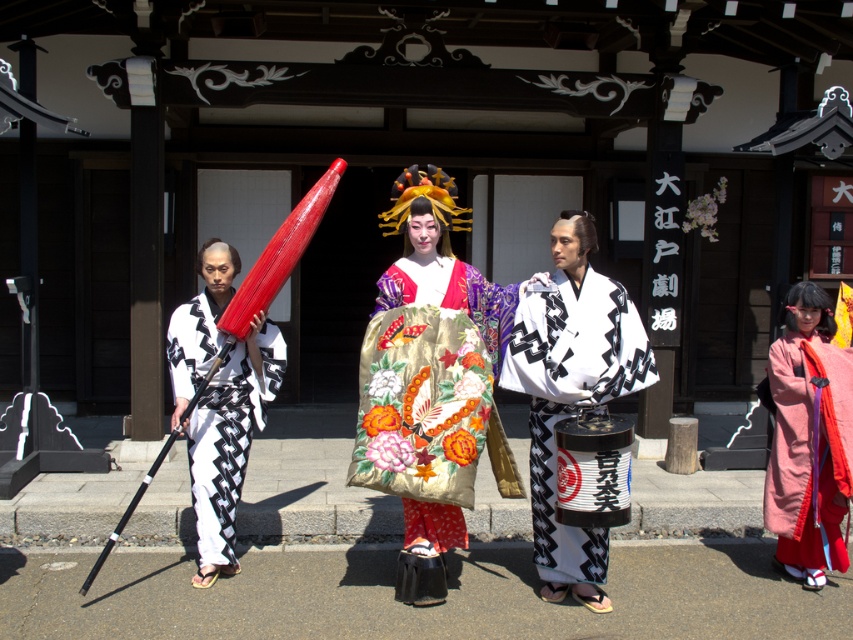
Question: Is silk kimono at center above matte black kimono at left?

Choices:
 (A) no
 (B) yes

Answer: (B)

Question: Does silky silk kimono at center have a smaller size compared to matte black kimono at left?

Choices:
 (A) yes
 (B) no

Answer: (B)

Question: Which of the following is the farthest from the observer?

Choices:
 (A) white silk kimono at center
 (B) matte black kimono at left
 (C) silky silk kimono at center
 (D) silky pink kimono at center

Answer: (D)

Question: Which point is closer to the camera?

Choices:
 (A) white silk kimono at center
 (B) silky silk kimono at center

Answer: (B)

Question: Can you confirm if silky silk kimono at center is positioned below matte black kimono at left?

Choices:
 (A) no
 (B) yes

Answer: (A)

Question: Among these objects, which one is farthest from the camera?

Choices:
 (A) white silk kimono at center
 (B) silk kimono at center
 (C) matte black kimono at left
 (D) silky silk kimono at center

Answer: (C)